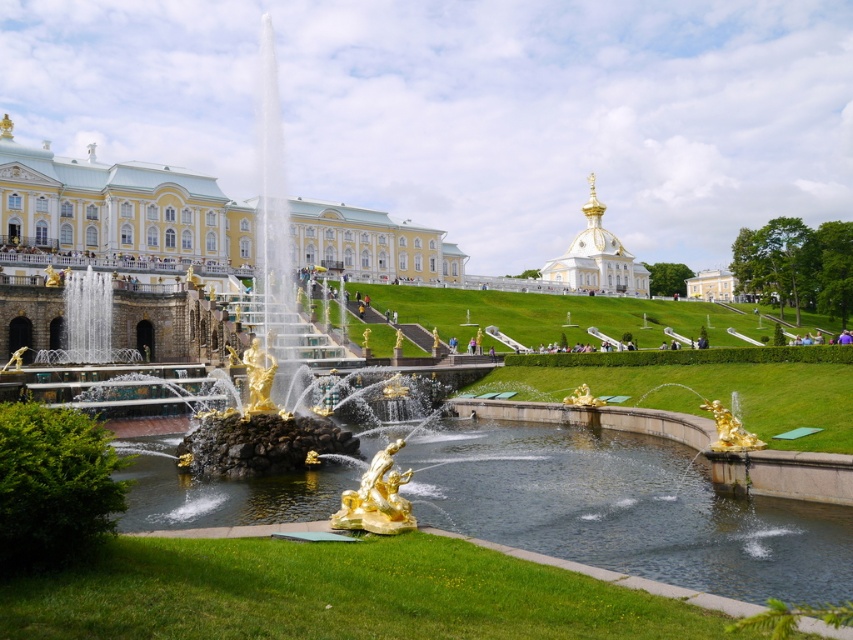
You are standing in front of the palace complex and want to take a photo. There are two points marked in the scene, point [350,516] and point [735,445]. Which point is closer to you?

Point [350,516] is closer to the camera than point [735,445], so it is the closer point.